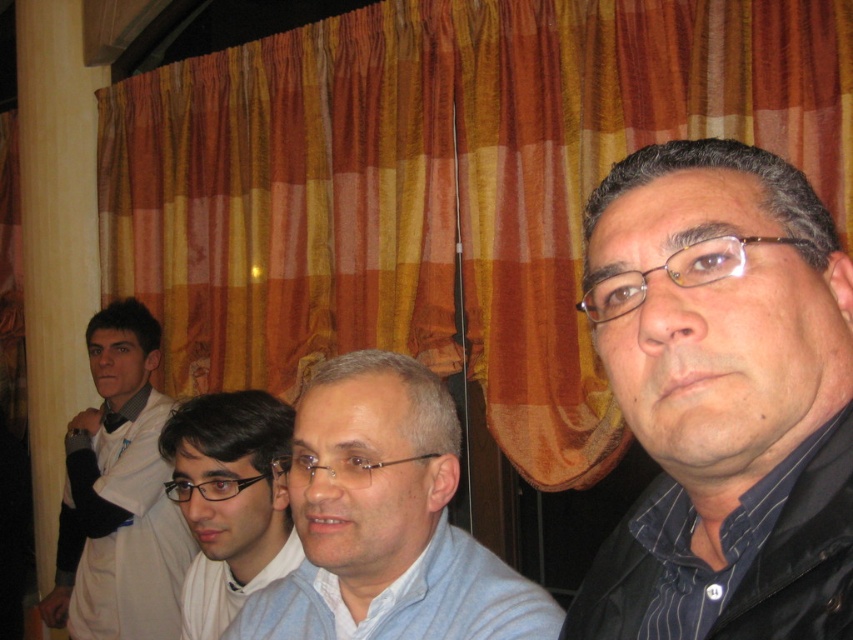
Is black matte shirt at center closer to the viewer compared to clear plastic glasses at center?

That is True.

Looking at this image, does black matte shirt at center appear on the left side of clear plastic glasses at center?

In fact, black matte shirt at center is to the right of clear plastic glasses at center.

Does point (712, 161) lie behind point (700, 243)?

Yes, point (712, 161) is farther from viewer.

Locate an element on the screen. The image size is (853, 640). black matte shirt at center is located at coordinates (722, 397).

Can you confirm if matte black glasses at center is thinner than clear plastic glasses at center?

In fact, matte black glasses at center might be wider than clear plastic glasses at center.

This screenshot has width=853, height=640. Describe the element at coordinates (229, 500) in the screenshot. I see `matte black glasses at center` at that location.

Identify the location of matte black glasses at center. (229, 500).

Is white shirt at left positioned in front of light blue cotton dress shirt at center?

No, it is not.

Can you confirm if white shirt at left is positioned below light blue cotton dress shirt at center?

Correct, white shirt at left is located below light blue cotton dress shirt at center.

At what (x,y) coordinates should I click in order to perform the action: click on white shirt at left. Please return your answer as a coordinate pair (x, y). The width and height of the screenshot is (853, 640). Looking at the image, I should click on (119, 496).